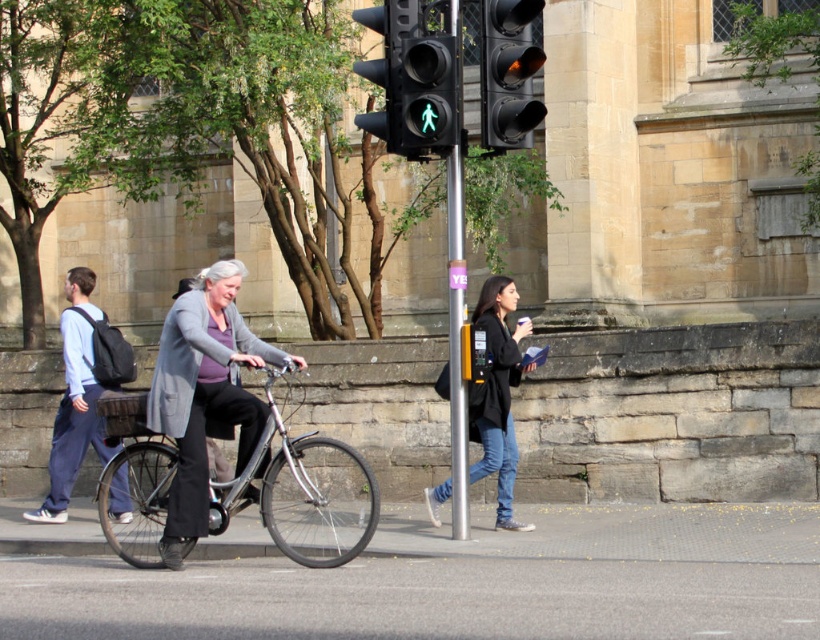
You are standing at the pedestrian crossing and see the matte gray jacket at center. If you want to reach it within 10 seconds, what is the minimum speed you need to maintain in meters per second?

To reach the matte gray jacket at center located 10.14 meters away within 10 seconds, you must maintain a minimum speed of 1.014 meters per second.

You are a pedestrian waiting at the crosswalk. You see the green matte pedestrian signal at center and the amber glass traffic light at center. Which one is closer to you?

The green matte pedestrian signal at center is closer to you because it is positioned further to the viewer than the amber glass traffic light at center.